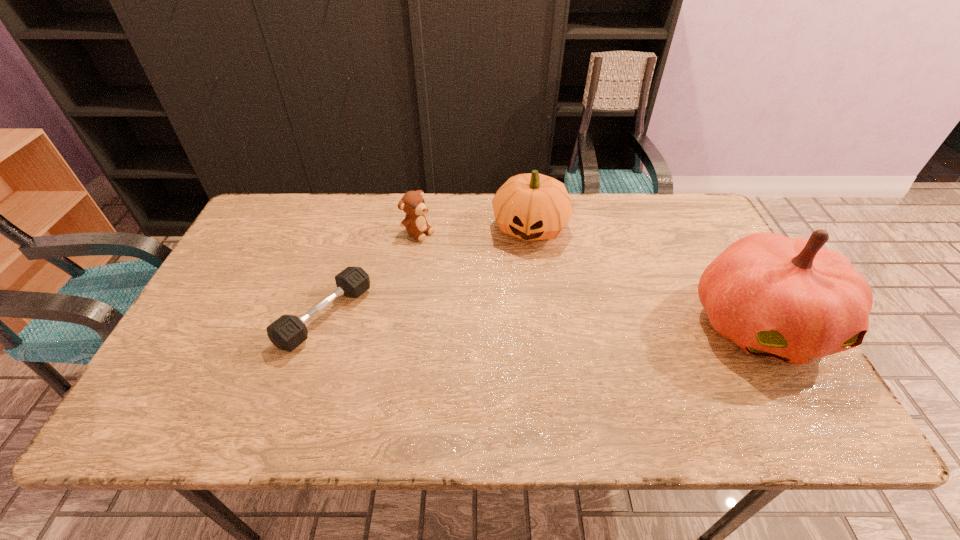
This screenshot has width=960, height=540. I want to click on the leftmost object, so click(287, 332).

Where is `the shortest object`? the shortest object is located at coordinates (287, 332).

The height and width of the screenshot is (540, 960). Find the location of `pumpkin`. pumpkin is located at coordinates (791, 299).

The height and width of the screenshot is (540, 960). Identify the location of the tallest object. (791, 299).

I want to click on gourd, so click(532, 206).

You are a GUI agent. You are given a task and a screenshot of the screen. Output one action in this format:
    pyautogui.click(x=<x>, y=<y>)
    Task: Click on the second tallest object
    The height and width of the screenshot is (540, 960).
    Given the screenshot: What is the action you would take?
    pyautogui.click(x=532, y=206)

This screenshot has width=960, height=540. Identify the location of the second object from left to right. (412, 203).

Locate an element on the screen. The image size is (960, 540). teddy bear is located at coordinates click(x=412, y=203).

This screenshot has width=960, height=540. Find the location of `blank space located 0.400m on the right of the shortest object`. blank space located 0.400m on the right of the shortest object is located at coordinates (522, 316).

In order to click on free spot located on the side of the second tallest object with the carved face in this screenshot , I will do `click(505, 345)`.